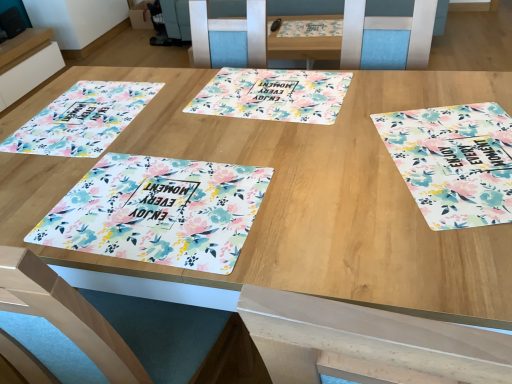
Locate an element on the screen. blank area beneath floral fabric placemat at right, which is the third tablecloth in left-to-right order (from a real-world perspective) is located at coordinates (454, 149).